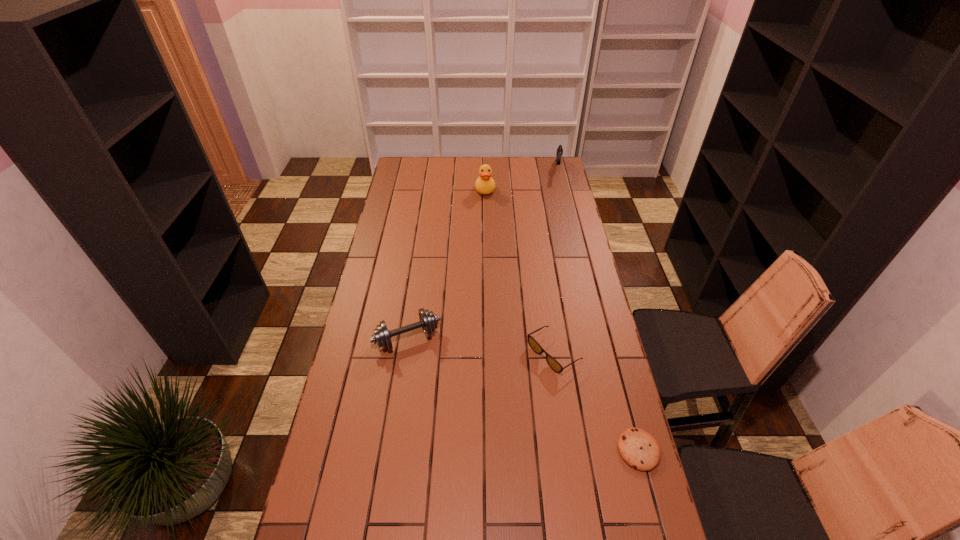
You are a GUI agent. You are given a task and a screenshot of the screen. Output one action in this format:
    pyautogui.click(x=<x>, y=<y>)
    Task: Click on the dumbbell
    The image size is (960, 540).
    Given the screenshot: What is the action you would take?
    pyautogui.click(x=428, y=321)

Locate an element on the screen. Image resolution: width=960 pixels, height=540 pixels. the leftmost object is located at coordinates (428, 321).

At what (x,y) coordinates should I click in order to perform the action: click on the nearest object. Please return your answer as a coordinate pair (x, y). Image resolution: width=960 pixels, height=540 pixels. Looking at the image, I should click on (639, 449).

What are the coordinates of `cookie` in the screenshot? It's located at (639, 449).

At what (x,y) coordinates should I click in order to perform the action: click on the second shortest object. Please return your answer as a coordinate pair (x, y). Image resolution: width=960 pixels, height=540 pixels. Looking at the image, I should click on (553, 363).

This screenshot has width=960, height=540. Find the location of `the third object from right to left`. the third object from right to left is located at coordinates (553, 363).

Where is `the tallest object`? the tallest object is located at coordinates (484, 184).

At what (x,y) coordinates should I click in order to perform the action: click on the second object from left to right. Please return your answer as a coordinate pair (x, y). This screenshot has width=960, height=540. Looking at the image, I should click on (484, 184).

You are a GUI agent. You are given a task and a screenshot of the screen. Output one action in this format:
    pyautogui.click(x=<x>, y=<y>)
    Task: Click on the farthest object
    
    Given the screenshot: What is the action you would take?
    pyautogui.click(x=559, y=153)

What are the coordinates of `free space located on the back of the leftmost object` in the screenshot? It's located at (417, 276).